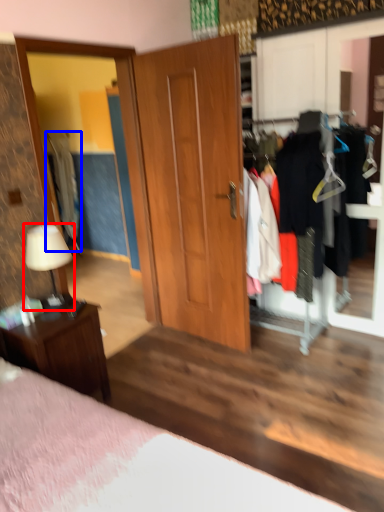
Question: Which object appears closest to the camera in this image, table lamp (highlighted by a red box) or clothing (highlighted by a blue box)?

Choices:
 (A) table lamp
 (B) clothing

Answer: (A)